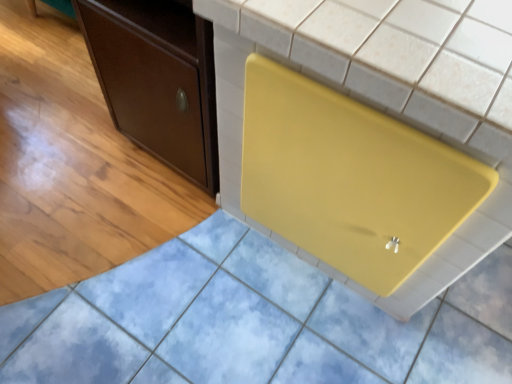
What is the approximate height of yellow matte cutting board at center?

86.26 centimeters.

At what (x,y) coordinates should I click in order to perform the action: click on yellow matte cutting board at center. Please return your answer as a coordinate pair (x, y). The image size is (512, 384). Looking at the image, I should click on (349, 178).

What do you see at coordinates (349, 178) in the screenshot? I see `yellow matte cutting board at center` at bounding box center [349, 178].

Image resolution: width=512 pixels, height=384 pixels. I want to click on matte brown cabinet at left, so click(x=157, y=79).

Image resolution: width=512 pixels, height=384 pixels. What do you see at coordinates (157, 79) in the screenshot?
I see `matte brown cabinet at left` at bounding box center [157, 79].

Locate an element on the screen. The height and width of the screenshot is (384, 512). yellow matte cutting board at center is located at coordinates pyautogui.click(x=349, y=178).

Is matte brown cabinet at left at the left side of yellow matte cutting board at center?

Yes.

Which object is further away from the camera taking this photo, matte brown cabinet at left or yellow matte cutting board at center?

matte brown cabinet at left.

Which is less distant, (x=203, y=146) or (x=275, y=231)?

The point (x=203, y=146) is closer.

From the image's perspective, is matte brown cabinet at left above or below yellow matte cutting board at center?

Clearly, from the image's perspective, matte brown cabinet at left is above yellow matte cutting board at center.

From a real-world perspective, is matte brown cabinet at left over yellow matte cutting board at center?

Actually, matte brown cabinet at left is physically below yellow matte cutting board at center in the real world.

Between matte brown cabinet at left and yellow matte cutting board at center, which one has larger width?

Wider between the two is yellow matte cutting board at center.

Consider the image. Considering the relative sizes of matte brown cabinet at left and yellow matte cutting board at center in the image provided, is matte brown cabinet at left shorter than yellow matte cutting board at center?

Yes, matte brown cabinet at left is shorter than yellow matte cutting board at center.

Considering the relative sizes of matte brown cabinet at left and yellow matte cutting board at center in the image provided, is matte brown cabinet at left smaller than yellow matte cutting board at center?

Yes, matte brown cabinet at left is smaller than yellow matte cutting board at center.

Is matte brown cabinet at left located outside yellow matte cutting board at center?

Yes, matte brown cabinet at left is not within yellow matte cutting board at center.

Is matte brown cabinet at left far from yellow matte cutting board at center?

No, matte brown cabinet at left is not far from yellow matte cutting board at center.

Could you tell me if matte brown cabinet at left is turned towards yellow matte cutting board at center?

No.

You are a GUI agent. You are given a task and a screenshot of the screen. Output one action in this format:
    pyautogui.click(x=<x>, y=<y>)
    Task: Click on the cabinetry below the yellow matte cutting board at center (from a real-world perspective)
    
    Given the screenshot: What is the action you would take?
    pyautogui.click(x=157, y=79)

Considering the positions of objects yellow matte cutting board at center and matte brown cabinet at left in the image provided, who is more to the right, yellow matte cutting board at center or matte brown cabinet at left?

From the viewer's perspective, yellow matte cutting board at center appears more on the right side.

Which object is further away from the camera, yellow matte cutting board at center or matte brown cabinet at left?

matte brown cabinet at left is further away from the camera.

Which is behind, point (462, 218) or point (215, 192)?

Point (215, 192)

From the image's perspective, who appears lower, yellow matte cutting board at center or matte brown cabinet at left?

yellow matte cutting board at center.

From a real-world perspective, which is physically above, yellow matte cutting board at center or matte brown cabinet at left?

yellow matte cutting board at center is physically above.

Is yellow matte cutting board at center wider or thinner than matte brown cabinet at left?

Considering their sizes, yellow matte cutting board at center looks broader than matte brown cabinet at left.

Is yellow matte cutting board at center shorter than matte brown cabinet at left?

No, yellow matte cutting board at center is not shorter than matte brown cabinet at left.

Is yellow matte cutting board at center bigger or smaller than matte brown cabinet at left?

yellow matte cutting board at center is bigger than matte brown cabinet at left.

Is yellow matte cutting board at center inside the boundaries of matte brown cabinet at left, or outside?

yellow matte cutting board at center is outside matte brown cabinet at left.

Is yellow matte cutting board at center next to matte brown cabinet at left and touching it?

No, yellow matte cutting board at center is not touching matte brown cabinet at left.

Does yellow matte cutting board at center turn towards matte brown cabinet at left?

No, yellow matte cutting board at center does not turn towards matte brown cabinet at left.

What's the angular difference between yellow matte cutting board at center and matte brown cabinet at left's facing directions?

The facing directions of yellow matte cutting board at center and matte brown cabinet at left are 92.9 degrees apart.

This screenshot has width=512, height=384. I want to click on appliance above the matte brown cabinet at left (from a real-world perspective), so click(349, 178).

Image resolution: width=512 pixels, height=384 pixels. Find the location of `appliance below the matte brown cabinet at left (from the image's perspective)`. appliance below the matte brown cabinet at left (from the image's perspective) is located at coordinates (349, 178).

Where is `cabinetry on the left of yellow matte cutting board at center`? Image resolution: width=512 pixels, height=384 pixels. cabinetry on the left of yellow matte cutting board at center is located at coordinates (157, 79).